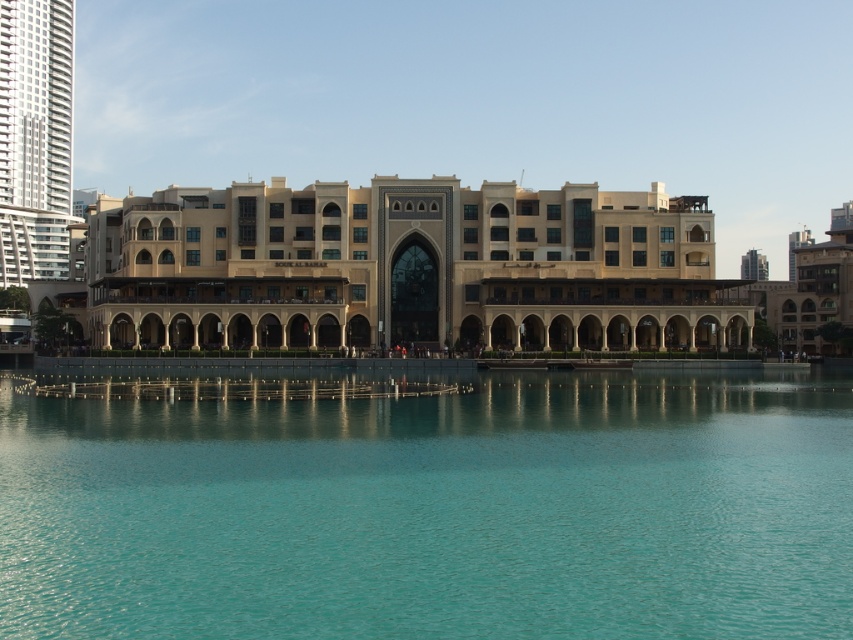
Question: Which object is the closest to the beige stone building at center?

Choices:
 (A) white glass skyscraper at left
 (B) turquoise liquid at center

Answer: (B)

Question: Does turquoise liquid at center have a greater width compared to beige stone building at center?

Choices:
 (A) yes
 (B) no

Answer: (B)

Question: Where is turquoise liquid at center located in relation to beige stone building at center in the image?

Choices:
 (A) left
 (B) right

Answer: (B)

Question: Which point appears farthest from the camera in this image?

Choices:
 (A) (55, 147)
 (B) (138, 584)
 (C) (608, 195)

Answer: (A)

Question: Is turquoise liquid at center to the right of white glass skyscraper at left from the viewer's perspective?

Choices:
 (A) no
 (B) yes

Answer: (B)

Question: Which of the following is the farthest from the observer?

Choices:
 (A) turquoise liquid at center
 (B) beige stone building at center

Answer: (B)